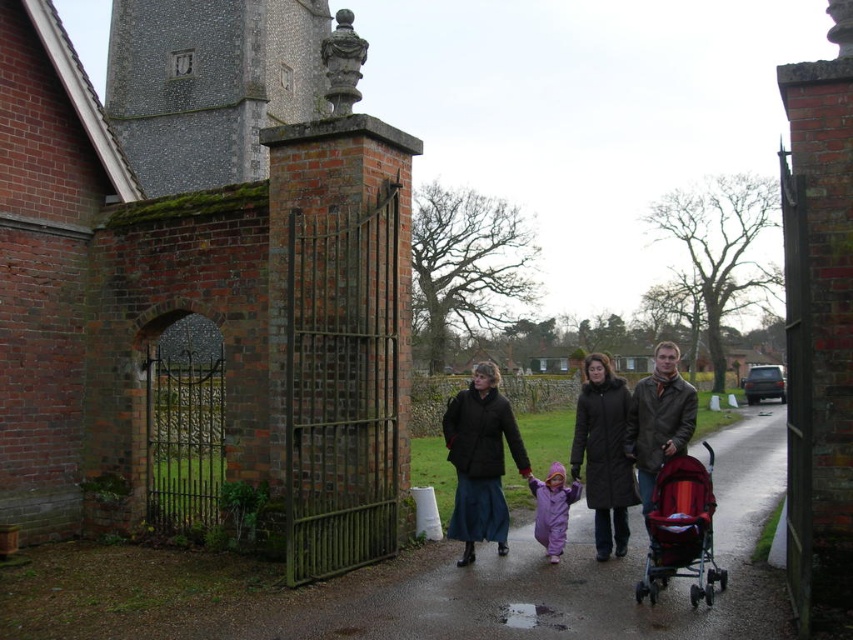
You are a delivery person trying to navigate through the narrow metal gate in the arched opening. You have a cart that is the same width as the purple fleece suit at center. Can your cart pass through the gate if the red fabric stroller at right is parked right next to it?

The red fabric stroller at right is wider than the purple fleece suit at center. Since the stroller is parked next to your cart, which has the same width as the purple fleece suit at center, there might not be enough space for both to fit through the narrow metal gate together. You should move the stroller aside before proceeding.